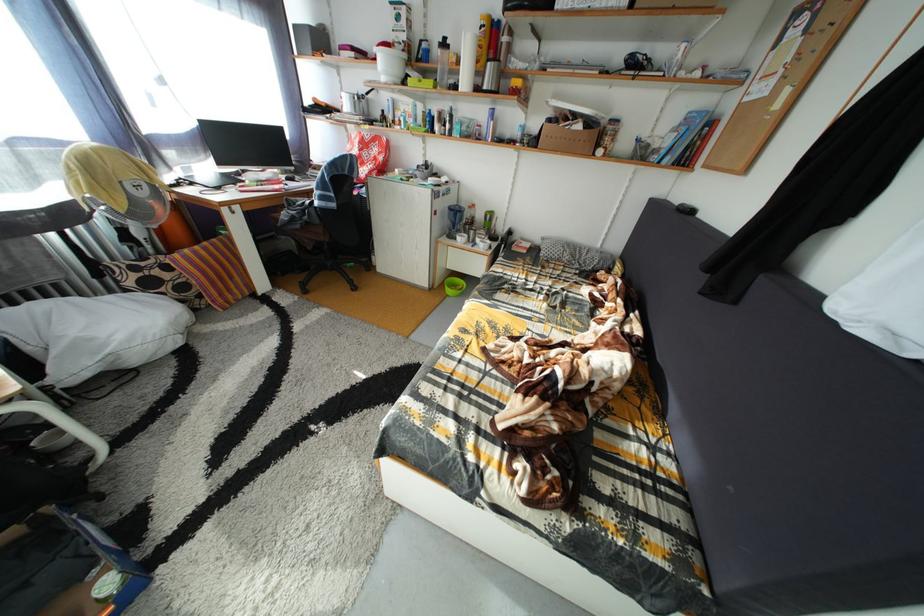
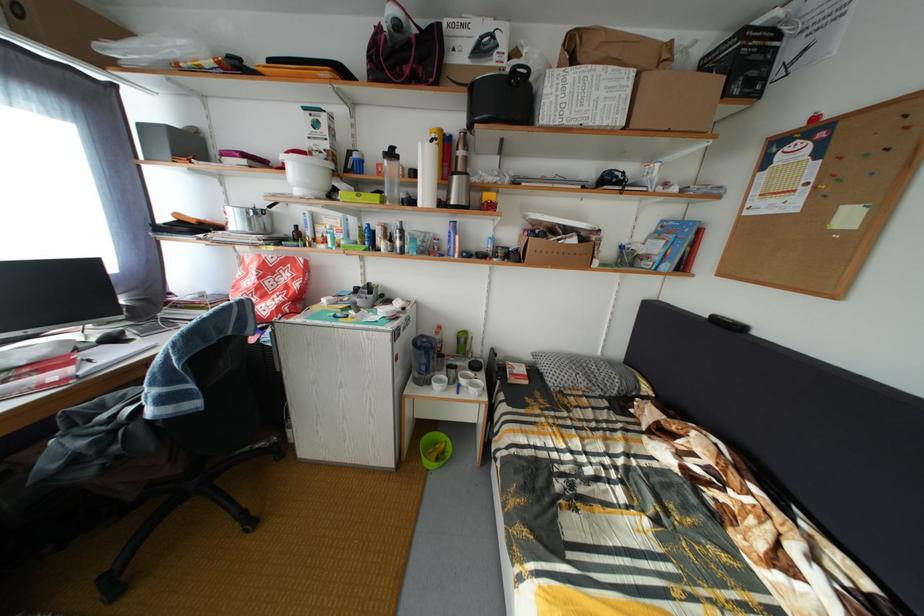
Where in the second image is the point corresponding to the point at 465,245 from the first image?

(438, 390)